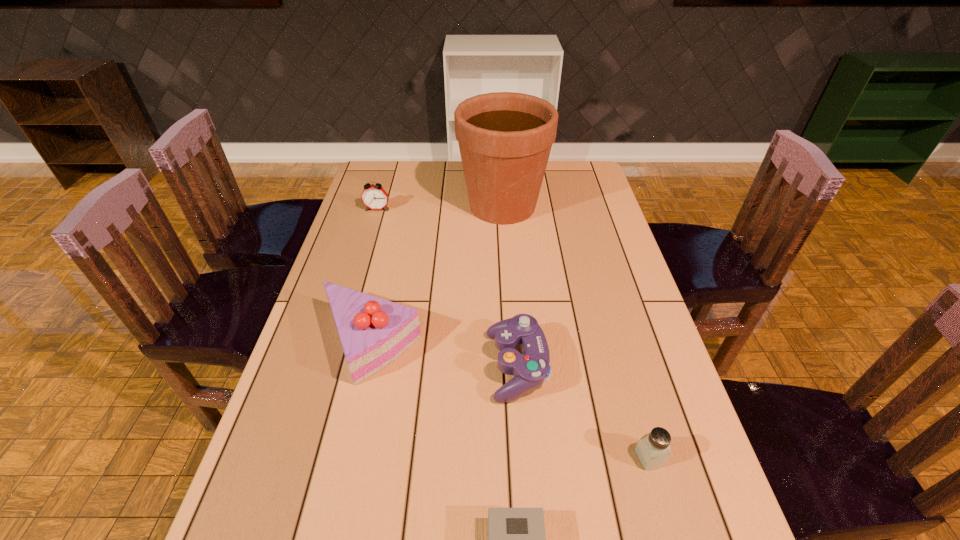
You are a GUI agent. You are given a task and a screenshot of the screen. Output one action in this format:
    pyautogui.click(x=<x>, y=<y>)
    Task: Click on the free spot at the far right corner of the desktop
    Image resolution: width=960 pixels, height=540 pixels.
    Given the screenshot: What is the action you would take?
    pyautogui.click(x=594, y=170)

Locate an element on the screen. This screenshot has width=960, height=540. unoccupied area between the cake and the control is located at coordinates (444, 355).

Find the location of `free spot between the left alarm clock and the control`. free spot between the left alarm clock and the control is located at coordinates (447, 288).

What are the coordinates of `free spot between the left alarm clock and the fifth shortest object` in the screenshot? It's located at (373, 276).

Where is `free spot between the control and the saltshaker`? Image resolution: width=960 pixels, height=540 pixels. free spot between the control and the saltshaker is located at coordinates (583, 412).

What are the coordinates of `free point between the farther alarm clock and the flowerpot` in the screenshot? It's located at (440, 207).

Identify which object is located as the second nearest to the nearest object. Please provide its 2D coordinates. Your answer should be formatted as a tuple, i.e. [(x, y)], where the tuple contains the x and y coordinates of a point satisfying the conditions above.

[(530, 369)]

Where is `the fourth closest object to the nearer alarm clock`? Image resolution: width=960 pixels, height=540 pixels. the fourth closest object to the nearer alarm clock is located at coordinates (505, 138).

Locate an element on the screen. The image size is (960, 540). vacant region that satisfies the following two spatial constraints: 1. on the clock face of the left alarm clock; 2. on the right side of the cake is located at coordinates (337, 343).

You are a GUI agent. You are given a task and a screenshot of the screen. Output one action in this format:
    pyautogui.click(x=<x>, y=<y>)
    Task: Click on the free space that satisfies the following two spatial constraints: 1. on the clock face of the left alarm clock; 2. on the left side of the control
    The image size is (960, 540).
    Given the screenshot: What is the action you would take?
    pyautogui.click(x=330, y=366)